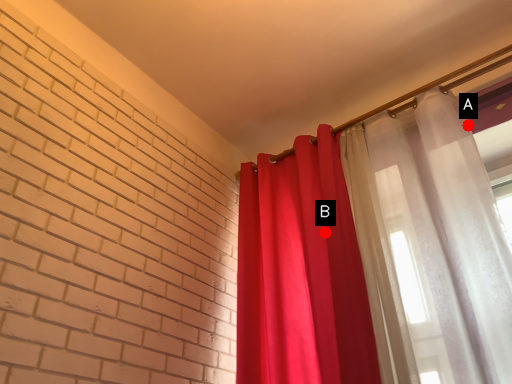
Question: Two points are circled on the image, labeled by A and B beside each circle. Which of the following is the closest to the observer?

Choices:
 (A) A is closer
 (B) B is closer

Answer: (A)